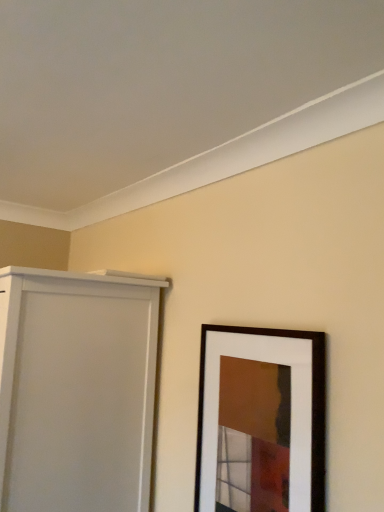
Question: From a real-world perspective, is white matte door at left above or below wooden picture frame at lower right?

Choices:
 (A) above
 (B) below

Answer: (B)

Question: Considering the relative positions of white matte door at left and wooden picture frame at lower right in the image provided, is white matte door at left to the left or to the right of wooden picture frame at lower right?

Choices:
 (A) left
 (B) right

Answer: (A)

Question: Considering the positions of white matte door at left and wooden picture frame at lower right in the image, is white matte door at left wider or thinner than wooden picture frame at lower right?

Choices:
 (A) thin
 (B) wide

Answer: (B)

Question: From the image's perspective, is wooden picture frame at lower right positioned above or below white matte door at left?

Choices:
 (A) above
 (B) below

Answer: (A)

Question: Considering the positions of wooden picture frame at lower right and white matte door at left in the image, is wooden picture frame at lower right taller or shorter than white matte door at left?

Choices:
 (A) tall
 (B) short

Answer: (B)

Question: Is wooden picture frame at lower right wider or thinner than white matte door at left?

Choices:
 (A) thin
 (B) wide

Answer: (A)

Question: Based on their positions, is wooden picture frame at lower right located to the left or right of white matte door at left?

Choices:
 (A) right
 (B) left

Answer: (A)